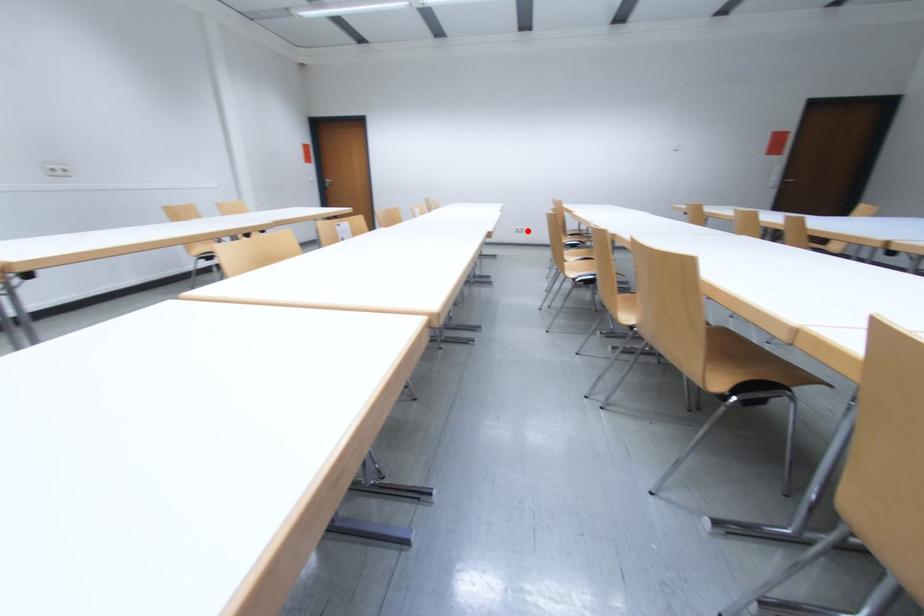
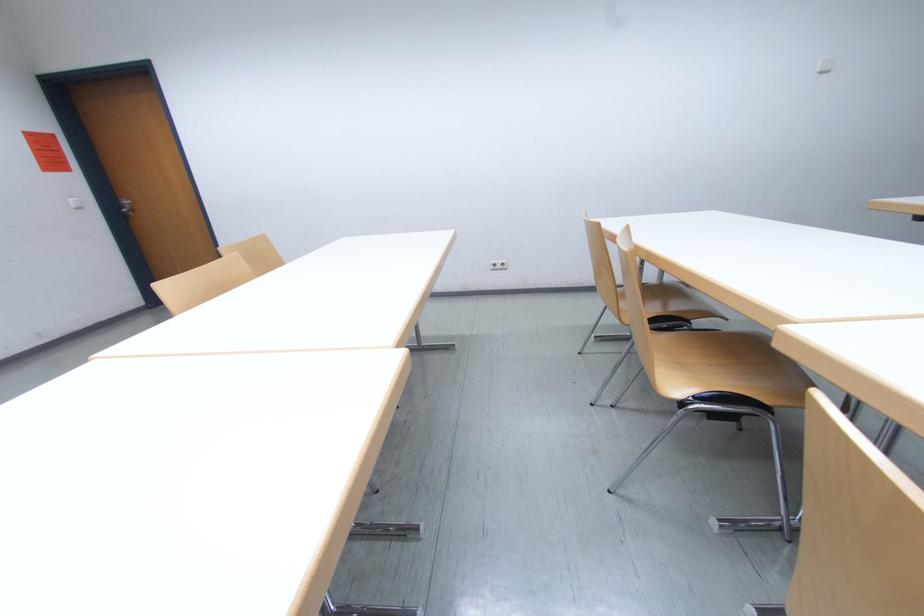
Question: I am providing you with two images of the same scene from different viewpoints. Given a red point in image1, look at the same physical point in image2. Is it:

Choices:
 (A) Closer to the viewpoint
 (B) Farther from the viewpoint

Answer: (B)